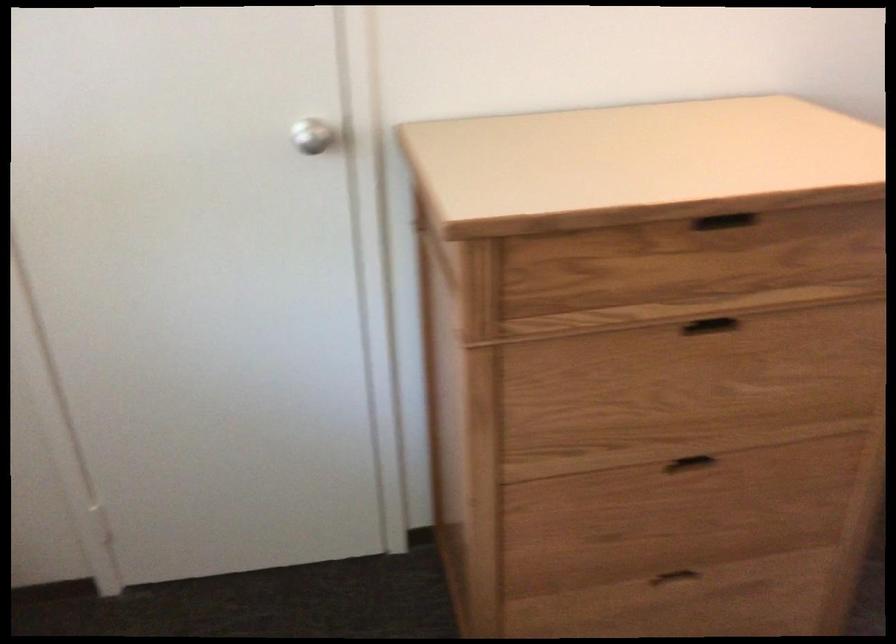
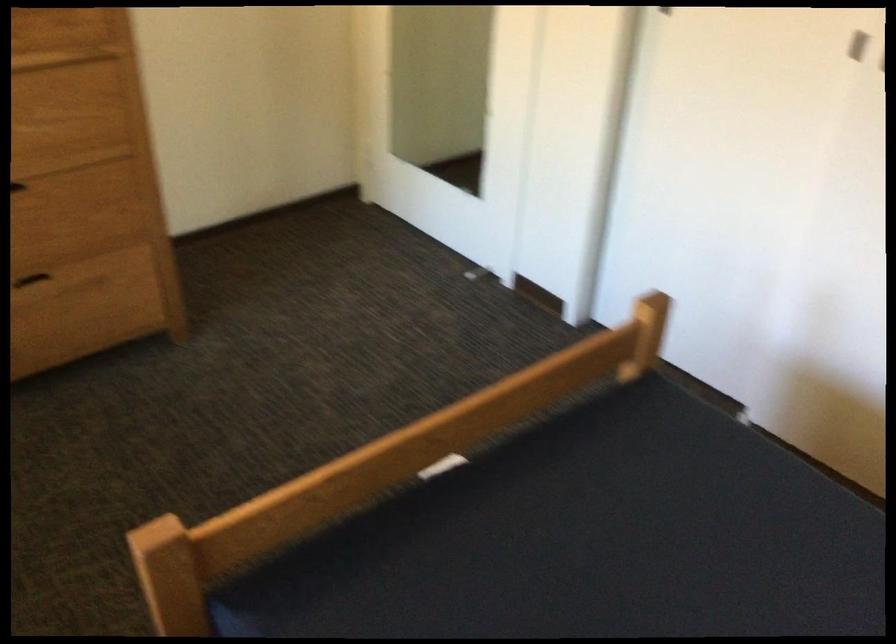
The point at (x=710, y=464) is marked in the first image. Where is the corresponding point in the second image?

(19, 187)